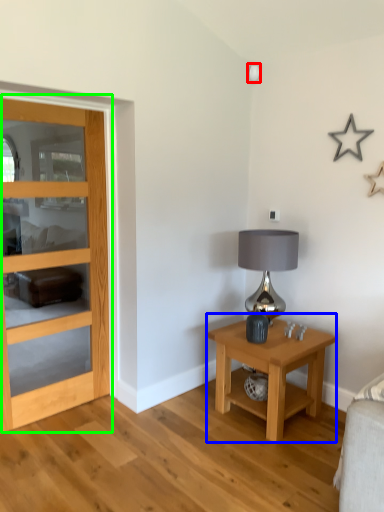
Question: Which object is the closest to the lamp (highlighted by a red box)? Choose among these: nightstand (highlighted by a blue box) or door (highlighted by a green box).

Choices:
 (A) nightstand
 (B) door

Answer: (B)